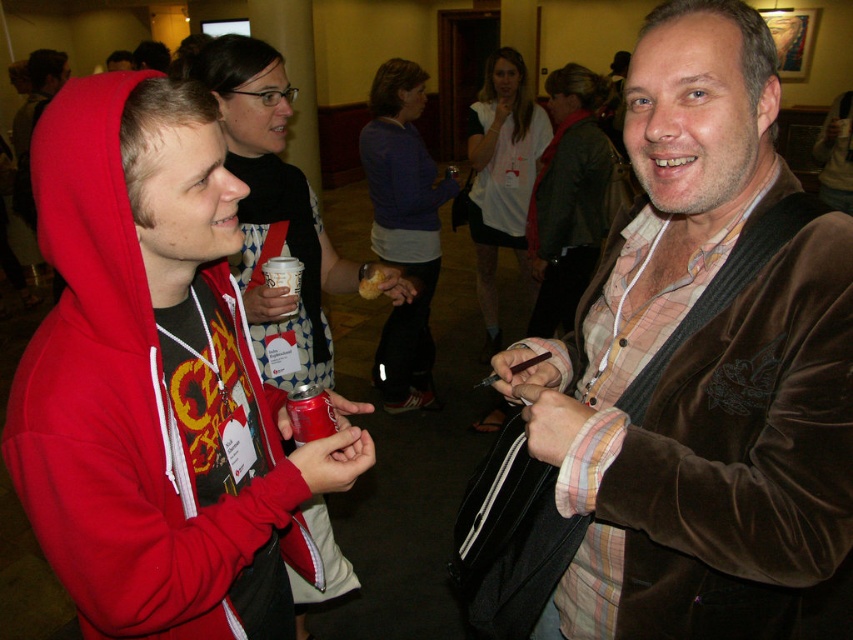
Question: Which point appears closest to the camera in this image?

Choices:
 (A) (332, 417)
 (B) (695, 348)

Answer: (B)

Question: From the image, what is the correct spatial relationship of metallic can at center in relation to white paper cup at center?

Choices:
 (A) below
 (B) above

Answer: (A)

Question: Which of the following is the closest to the observer?

Choices:
 (A) white paper cup at center
 (B) metallic can at center

Answer: (B)

Question: Which of the following is the closest to the observer?

Choices:
 (A) white paper cup at center
 (B) velvet brown jacket at center
 (C) metallic can at center

Answer: (B)

Question: Does velvet brown jacket at center lie behind white paper cup at center?

Choices:
 (A) no
 (B) yes

Answer: (A)

Question: Can you confirm if metallic can at center is positioned below white paper cup at center?

Choices:
 (A) no
 (B) yes

Answer: (B)